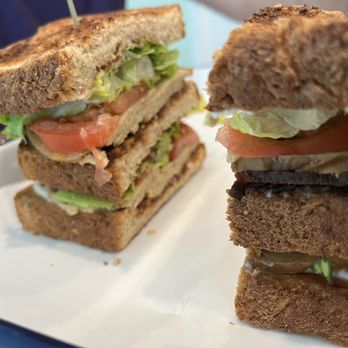
Where is `crumb`? This screenshot has width=348, height=348. crumb is located at coordinates (116, 261), (153, 231).